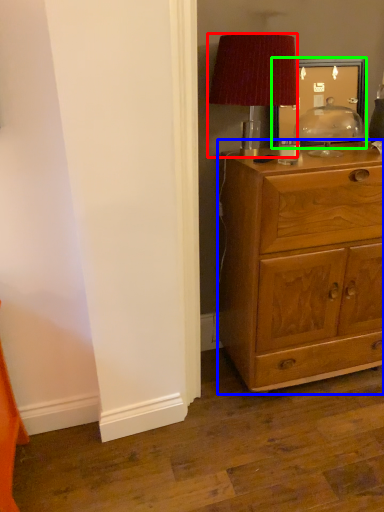
Question: Which object is positioned closest to lamp (highlighted by a red box)? Select from chest of drawers (highlighted by a blue box) and picture frame (highlighted by a green box).

Choices:
 (A) chest of drawers
 (B) picture frame

Answer: (B)